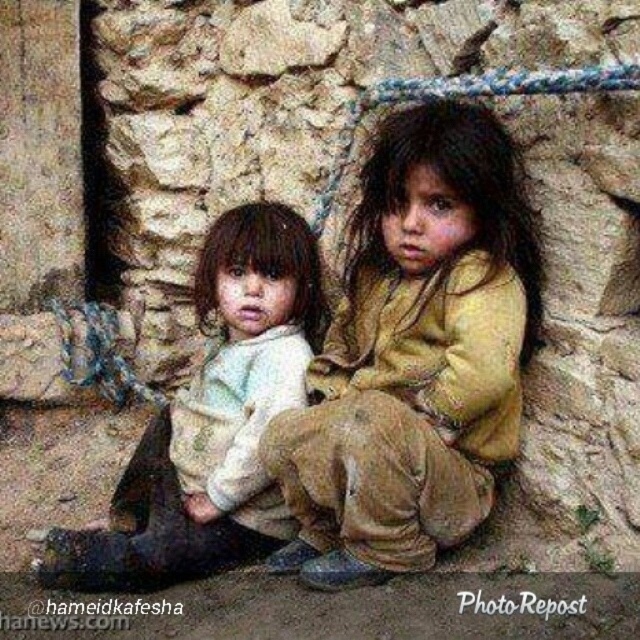
Question: Is brown textured cloth at center further to the viewer compared to white soft fabric at center?

Choices:
 (A) yes
 (B) no

Answer: (B)

Question: Which point is farther to the camera?

Choices:
 (A) white soft fabric at center
 (B) brown textured cloth at center

Answer: (A)

Question: Does brown textured cloth at center have a lesser width compared to white soft fabric at center?

Choices:
 (A) no
 (B) yes

Answer: (B)

Question: Is brown textured cloth at center positioned behind white soft fabric at center?

Choices:
 (A) no
 (B) yes

Answer: (A)